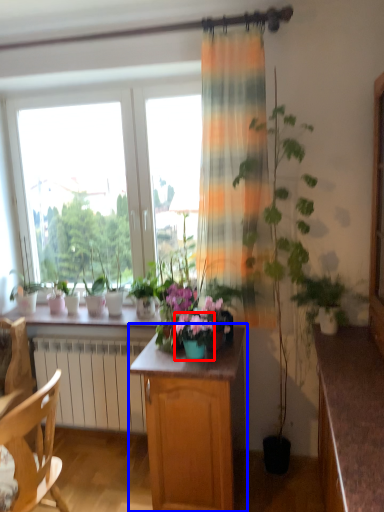
Question: Which object appears closest to the camera in this image, flower box (highlighted by a red box) or cabinetry (highlighted by a blue box)?

Choices:
 (A) flower box
 (B) cabinetry

Answer: (B)